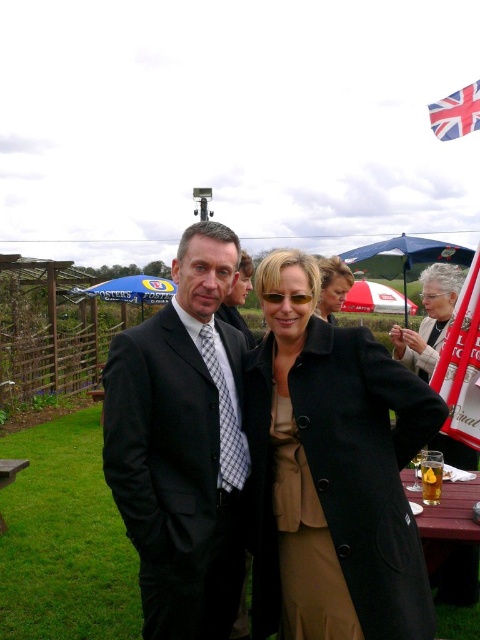
Is matte black suit at center above union jack fabric at upper right?

Actually, matte black suit at center is below union jack fabric at upper right.

Can you confirm if matte black suit at center is positioned to the left of union jack fabric at upper right?

Yes, matte black suit at center is to the left of union jack fabric at upper right.

Image resolution: width=480 pixels, height=640 pixels. What do you see at coordinates (181, 444) in the screenshot?
I see `matte black suit at center` at bounding box center [181, 444].

This screenshot has width=480, height=640. I want to click on matte black suit at center, so click(181, 444).

Based on the photo, between brown leather jacket at center and translucent glass mug at center, which one has less height?

translucent glass mug at center

What do you see at coordinates (429, 320) in the screenshot? Image resolution: width=480 pixels, height=640 pixels. I see `brown leather jacket at center` at bounding box center [429, 320].

Does point (394, 348) come closer to viewer compared to point (430, 499)?

No, it is behind (430, 499).

Where is `brown leather jacket at center`? brown leather jacket at center is located at coordinates (429, 320).

Can you confirm if matte black suit at center is taller than brown leather jacket at center?

Yes, matte black suit at center is taller than brown leather jacket at center.

Based on the photo, who is shorter, matte black suit at center or brown leather jacket at center?

Standing shorter between the two is brown leather jacket at center.

Where is `matte black suit at center`? The height and width of the screenshot is (640, 480). matte black suit at center is located at coordinates (181, 444).

Locate an element on the screen. The image size is (480, 640). matte black suit at center is located at coordinates click(x=181, y=444).